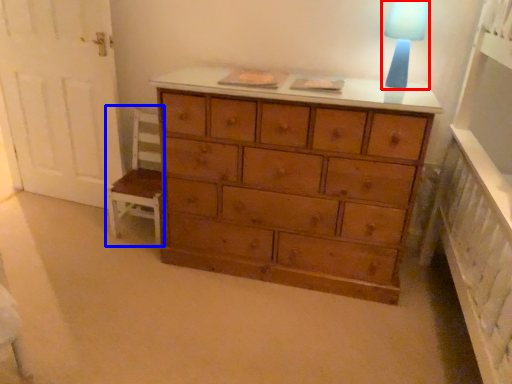
Question: Among these objects, which one is farthest to the camera, lamp (highlighted by a red box) or armchair (highlighted by a blue box)?

Choices:
 (A) lamp
 (B) armchair

Answer: (B)